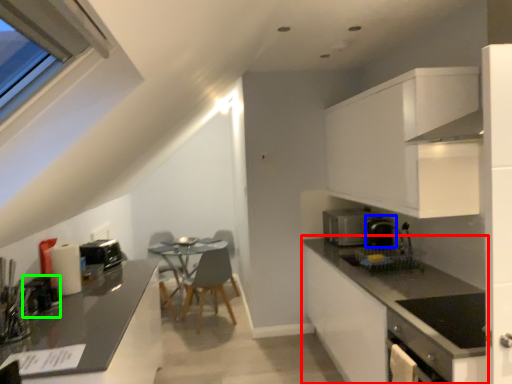
Question: Which is farther away from countertop (highlighted by a red box)? coffee machine (highlighted by a blue box) or appliance (highlighted by a green box)?

Choices:
 (A) coffee machine
 (B) appliance

Answer: (B)